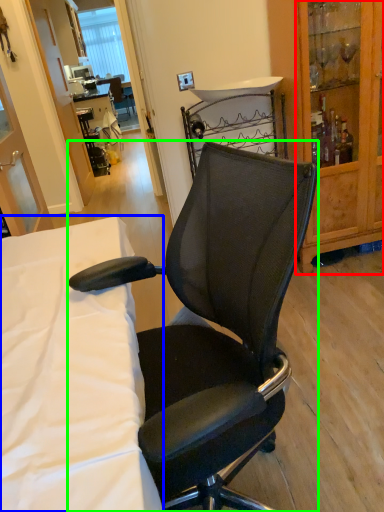
Question: Which object is positioned closest to cabinetry (highlighted by a red box)? Select from desk (highlighted by a blue box) and chair (highlighted by a green box).

Choices:
 (A) desk
 (B) chair

Answer: (B)